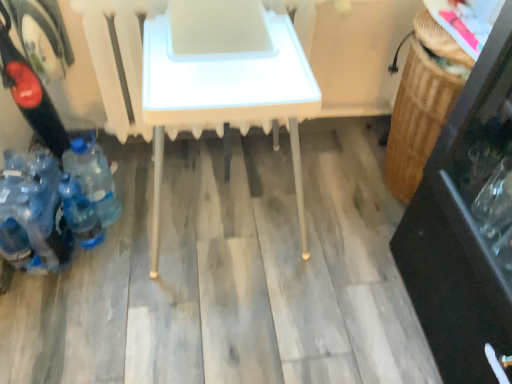
Find the location of a particular element. vacant space in front of blue plastic bottles at lower left, the first bottle in the left-to-right sequence is located at coordinates (41, 306).